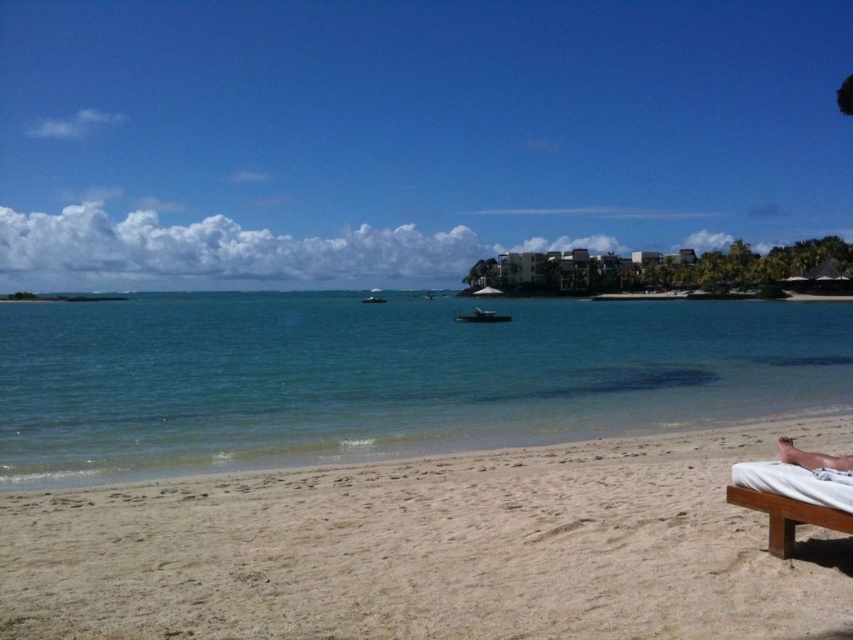
Can you confirm if clear blue water at center is positioned above tan skin person at lower right?

Yes.

How much distance is there between clear blue water at center and tan skin person at lower right?

They are 68.45 meters apart.

Is point (407, 420) closer to viewer compared to point (798, 456)?

No, (407, 420) is behind (798, 456).

At what (x,y) coordinates should I click in order to perform the action: click on clear blue water at center. Please return your answer as a coordinate pair (x, y). This screenshot has width=853, height=640. Looking at the image, I should click on (384, 376).

Between white fabric beach chair at lower right and tan skin person at lower right, which one is positioned lower?

white fabric beach chair at lower right

Who is shorter, white fabric beach chair at lower right or tan skin person at lower right?

Standing shorter between the two is tan skin person at lower right.

Which is behind, point (779, 547) or point (846, 458)?

The point (779, 547) is more distant.

Identify the location of white fabric beach chair at lower right. This screenshot has height=640, width=853. (791, 499).

Does clear blue water at center have a smaller size compared to white fabric beach chair at lower right?

No, clear blue water at center is not smaller than white fabric beach chair at lower right.

Describe the element at coordinates (384, 376) in the screenshot. The height and width of the screenshot is (640, 853). I see `clear blue water at center` at that location.

At what (x,y) coordinates should I click in order to perform the action: click on clear blue water at center. Please return your answer as a coordinate pair (x, y). Image resolution: width=853 pixels, height=640 pixels. Looking at the image, I should click on (384, 376).

The width and height of the screenshot is (853, 640). What are the coordinates of `clear blue water at center` in the screenshot? It's located at (384, 376).